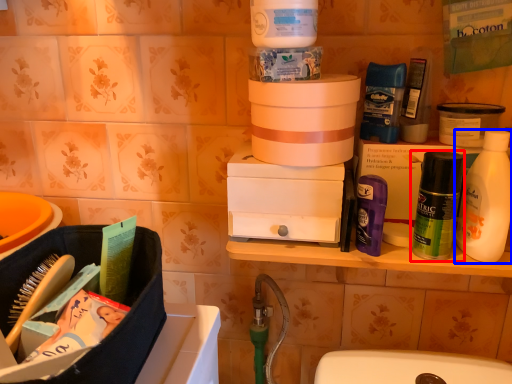
Question: Which object is closer to the camera taking this photo, mouthwash (highlighted by a red box) or bottle (highlighted by a blue box)?

Choices:
 (A) mouthwash
 (B) bottle

Answer: (B)